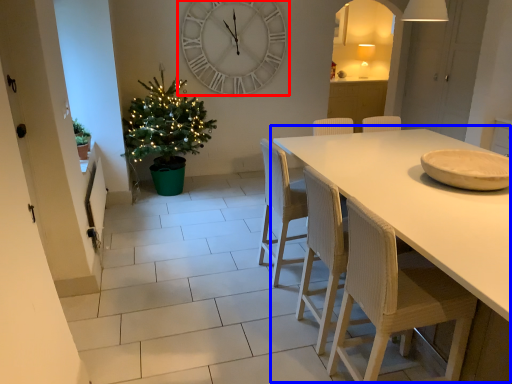
Question: Which object is further to the camera taking this photo, wall clock (highlighted by a red box) or table (highlighted by a blue box)?

Choices:
 (A) wall clock
 (B) table

Answer: (A)